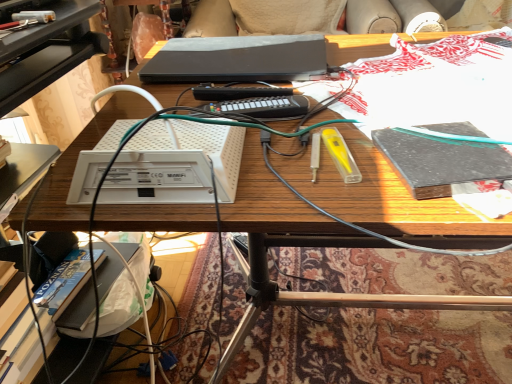
Question: In terms of height, does black matte book at right look taller or shorter compared to white plastic router at center?

Choices:
 (A) short
 (B) tall

Answer: (A)

Question: Considering the positions of black matte book at right and white plastic router at center in the image, is black matte book at right wider or thinner than white plastic router at center?

Choices:
 (A) thin
 (B) wide

Answer: (A)

Question: Which object is the farthest from the black matte book at right?

Choices:
 (A) black matte laptop at center
 (B) white plastic router at center

Answer: (A)

Question: Which object is positioned closest to the black matte book at right?

Choices:
 (A) white plastic router at center
 (B) black matte laptop at center

Answer: (A)